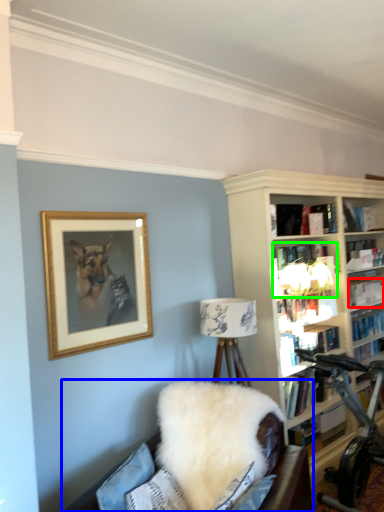
Question: Which is nearer to the book (highlighted by a red box)? studio couch (highlighted by a blue box) or book (highlighted by a green box).

Choices:
 (A) studio couch
 (B) book

Answer: (B)